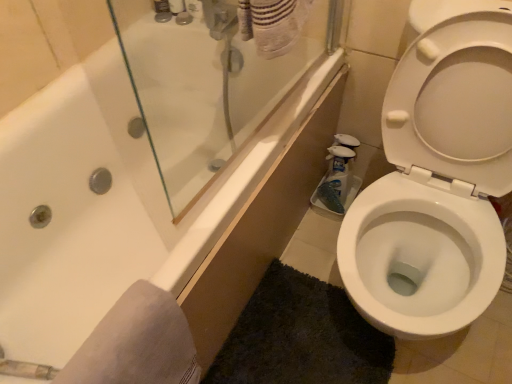
I want to click on free region under dark gray shaggy bath mat at lower right (from a real-world perspective), so click(290, 350).